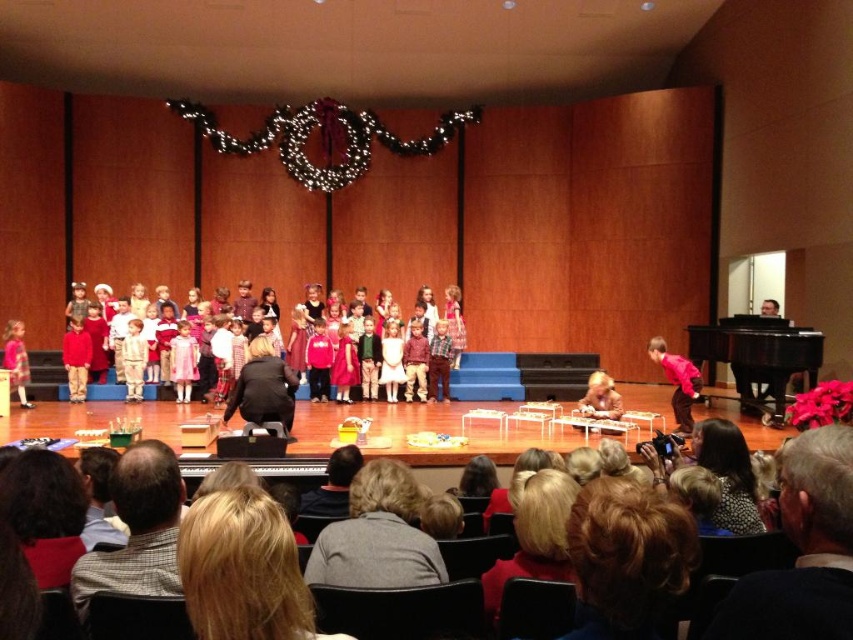
Which is in front, point (152, 512) or point (753, 365)?

Point (152, 512) is more forward.

Measure the distance between gray checkered shirt at lower left and camera.

They are 2.75 meters apart.

Find the location of `gray checkered shirt at lower left`. gray checkered shirt at lower left is located at coordinates (137, 529).

Which of these two, gray wool sweater at lower right or black polished piano at right, stands taller?

Standing taller between the two is black polished piano at right.

Consider the image. Does gray wool sweater at lower right have a lesser width compared to black polished piano at right?

Yes.

Who is more distant from viewer, (822, 602) or (741, 401)?

Point (741, 401)

At what (x,y) coordinates should I click in order to perform the action: click on gray wool sweater at lower right. Please return your answer as a coordinate pair (x, y). The width and height of the screenshot is (853, 640). Looking at the image, I should click on (x=802, y=550).

Does point (599, 540) lie in front of point (277, 314)?

That is True.

Does blonde hair at lower center appear on the left side of dressy red skirts at center?

No, blonde hair at lower center is not to the left of dressy red skirts at center.

Which is in front, point (631, 576) or point (453, 371)?

Point (631, 576) is more forward.

This screenshot has height=640, width=853. I want to click on blonde hair at lower center, so click(x=630, y=554).